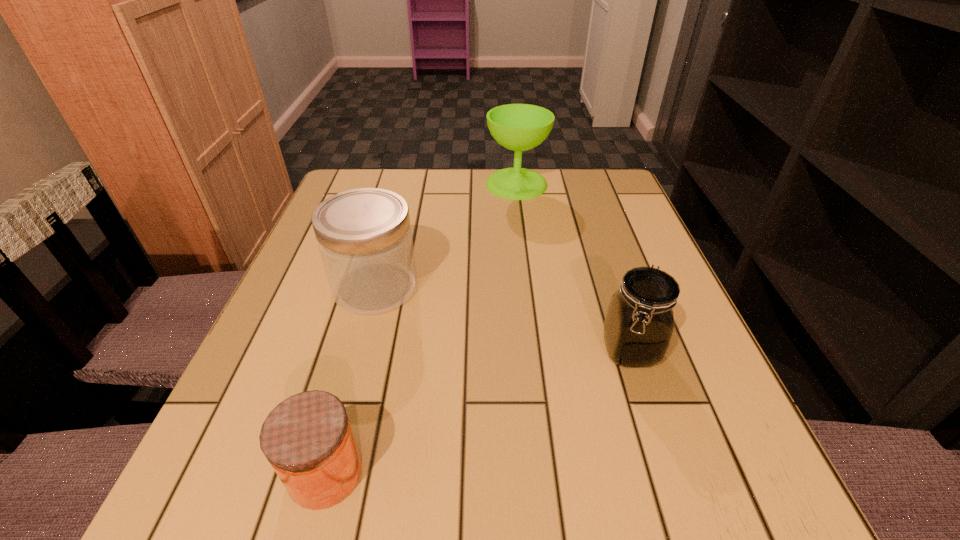
Locate an element on the screen. blank region between the second nearest jar and the wineglass is located at coordinates (573, 267).

Identify which object is located as the third nearest to the wineglass. Please provide its 2D coordinates. Your answer should be formatted as a tuple, i.e. [(x, y)], where the tuple contains the x and y coordinates of a point satisfying the conditions above.

[(307, 438)]

At what (x,y) coordinates should I click in order to perform the action: click on object identified as the second closest to the rightmost jar. Please return your answer as a coordinate pair (x, y). Image resolution: width=960 pixels, height=540 pixels. Looking at the image, I should click on (307, 438).

Identify the location of jar that stands as the second closest to the second nearest object. coord(307,438).

Locate which jar is the closest to the nearest jar. Please provide its 2D coordinates. Your answer should be formatted as a tuple, i.e. [(x, y)], where the tuple contains the x and y coordinates of a point satisfying the conditions above.

[(364, 236)]

This screenshot has height=540, width=960. In order to click on vacant point that satisfies the following two spatial constraints: 1. on the back side of the farthest object; 2. on the right side of the third nearest object in this screenshot , I will do `click(403, 184)`.